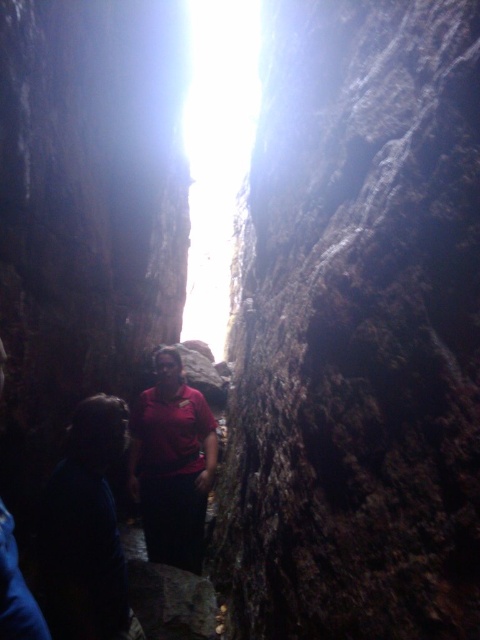
Who is positioned more to the right, dark blue shirt at left or matte red shirt at center?

matte red shirt at center

Is dark blue shirt at left below matte red shirt at center?

Incorrect, dark blue shirt at left is not positioned below matte red shirt at center.

Between point (141, 636) and point (215, 420), which one is positioned behind?

The point (215, 420) is more distant.

Locate an element on the screen. The width and height of the screenshot is (480, 640). dark blue shirt at left is located at coordinates (85, 529).